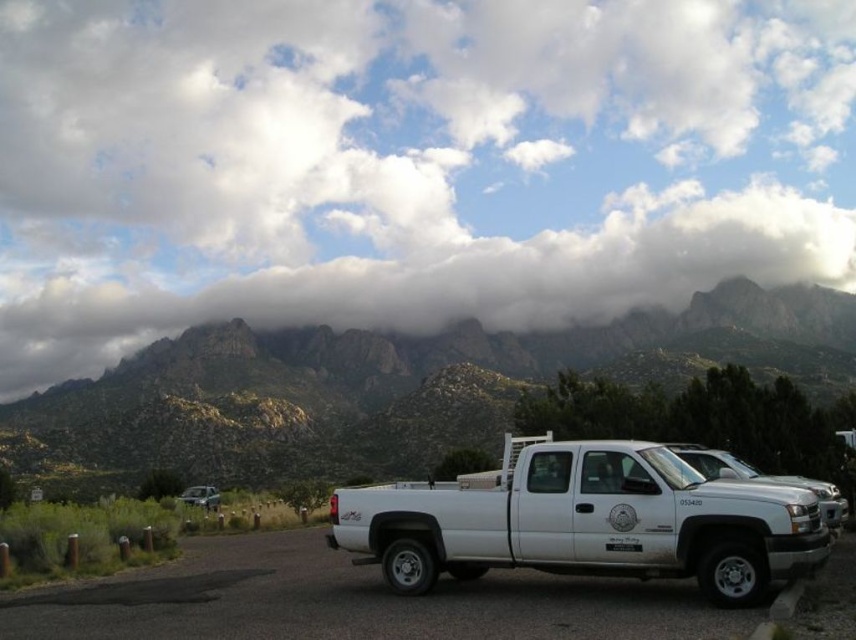
Does white matte truck at center appear on the left side of metallic silver suv at lower left?

No, white matte truck at center is not to the left of metallic silver suv at lower left.

Between white matte truck at center and metallic silver suv at lower left, which one appears on the left side from the viewer's perspective?

metallic silver suv at lower left

Is point (541, 550) farther from camera compared to point (211, 500)?

No, (541, 550) is in front of (211, 500).

The width and height of the screenshot is (856, 640). In order to click on white matte truck at center in this screenshot , I will do `click(586, 520)`.

Can you confirm if white fluffy cloud at upper center is positioned below rugged stone mountains at upper center?

No, white fluffy cloud at upper center is not below rugged stone mountains at upper center.

Does point (126, 246) lie in front of point (599, 356)?

That is False.

Who is more distant from viewer, (30,364) or (274,444)?

Point (30,364)

Find the location of a particular element. white fluffy cloud at upper center is located at coordinates (407, 163).

Which is more to the left, rugged stone mountains at upper center or metallic silver suv at lower left?

metallic silver suv at lower left is more to the left.

Does point (384, 337) lie behind point (207, 492)?

Yes, point (384, 337) is behind point (207, 492).

Locate an element on the screen. This screenshot has height=640, width=856. rugged stone mountains at upper center is located at coordinates (391, 385).